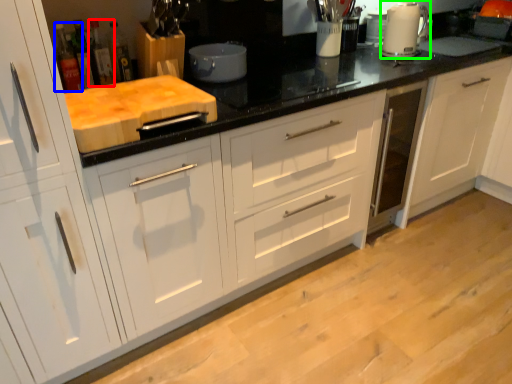
Question: Which object is positioned closest to bottle (highlighted by a red box)? Select from bottle (highlighted by a blue box) and home appliance (highlighted by a green box).

Choices:
 (A) bottle
 (B) home appliance

Answer: (A)